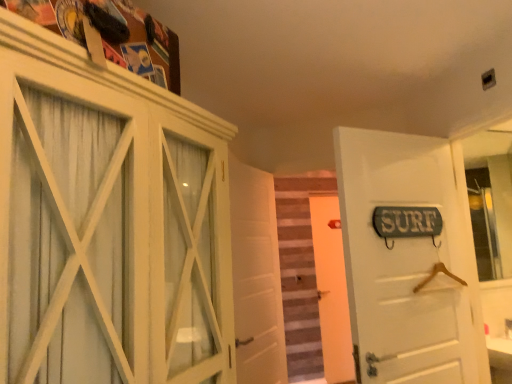
Question: Does white wooden door at center, which is the 1th door in back-to-front order, have a lesser height compared to white matte door at center, the second door viewed from the back?

Choices:
 (A) yes
 (B) no

Answer: (B)

Question: From the image's perspective, is white wooden door at center, which is the 1th door in back-to-front order, over white matte door at center, the second door viewed from the back?

Choices:
 (A) yes
 (B) no

Answer: (B)

Question: Can you confirm if white wooden door at center, which is the 1th door in back-to-front order, is bigger than white matte door at center, the 2th door when ordered from front to back?

Choices:
 (A) no
 (B) yes

Answer: (A)

Question: Is white wooden door at center, which is the 1th door in back-to-front order, positioned in front of white matte door at center, the 2th door when ordered from front to back?

Choices:
 (A) yes
 (B) no

Answer: (B)

Question: From the image's perspective, is white wooden door at center, arranged as the third door when viewed from the front, below white matte door at center, the 2th door when ordered from front to back?

Choices:
 (A) yes
 (B) no

Answer: (A)

Question: From a real-world perspective, relative to white wooden door at center, arranged as the third door when viewed from the front, is clear glass mirror at right vertically above or below?

Choices:
 (A) above
 (B) below

Answer: (A)

Question: Choose the correct answer: Is clear glass mirror at right inside white wooden door at center, arranged as the third door when viewed from the front, or outside it?

Choices:
 (A) outside
 (B) inside

Answer: (A)

Question: From the image's perspective, is clear glass mirror at right positioned above or below white wooden door at center, arranged as the third door when viewed from the front?

Choices:
 (A) above
 (B) below

Answer: (A)

Question: In the image, is clear glass mirror at right positioned in front of or behind white wooden door at center, which is the 1th door in back-to-front order?

Choices:
 (A) behind
 (B) front

Answer: (B)

Question: Is wooden stairs at center taller or shorter than white wooden door at center, arranged as the third door when viewed from the front?

Choices:
 (A) short
 (B) tall

Answer: (A)

Question: Considering the positions of point (296, 279) and point (335, 203), is point (296, 279) closer or farther from the camera than point (335, 203)?

Choices:
 (A) farther
 (B) closer

Answer: (B)

Question: From the image's perspective, is wooden stairs at center positioned above or below white wooden door at center, arranged as the third door when viewed from the front?

Choices:
 (A) below
 (B) above

Answer: (B)

Question: In terms of size, does wooden stairs at center appear bigger or smaller than white wooden door at center, which is the 1th door in back-to-front order?

Choices:
 (A) big
 (B) small

Answer: (B)

Question: Considering the positions of white wooden door at center, which is the 1th door in back-to-front order, and wooden stairs at center in the image, is white wooden door at center, which is the 1th door in back-to-front order, wider or thinner than wooden stairs at center?

Choices:
 (A) wide
 (B) thin

Answer: (B)

Question: Is white wooden door at center, arranged as the third door when viewed from the front, in front of or behind wooden stairs at center in the image?

Choices:
 (A) behind
 (B) front

Answer: (A)